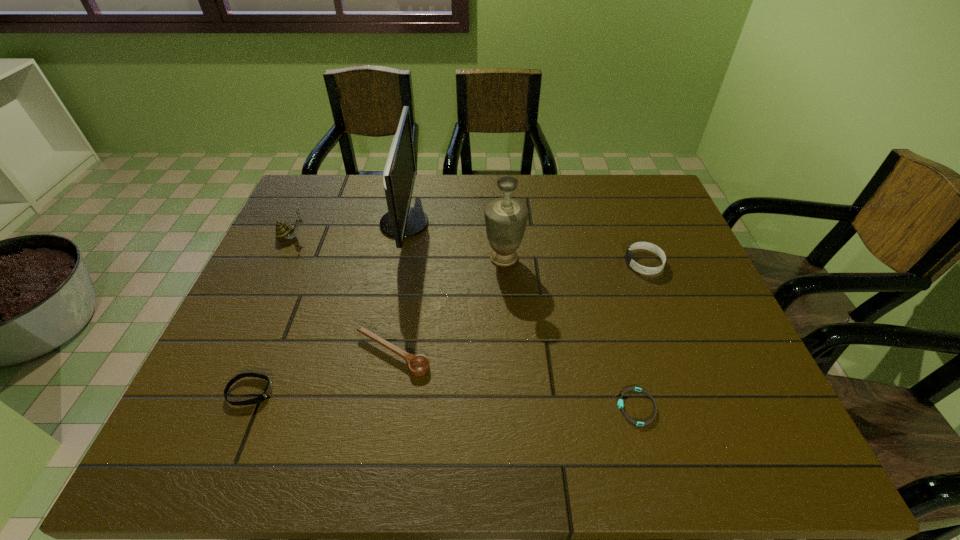
Locate an element on the screen. This screenshot has height=540, width=960. free region located 0.310m on the buckle of the shortest object is located at coordinates (468, 407).

Locate an element on the screen. Image resolution: width=960 pixels, height=540 pixels. vacant space located on the buckle of the shortest object is located at coordinates (492, 407).

Locate an element on the screen. This screenshot has width=960, height=540. free region located 0.150m on the buckle of the shortest object is located at coordinates tap(544, 407).

Find the location of a particular element. object that is at the far edge is located at coordinates (401, 221).

The height and width of the screenshot is (540, 960). Find the location of `object that is at the near edge`. object that is at the near edge is located at coordinates (620, 405).

Image resolution: width=960 pixels, height=540 pixels. What are the coordinates of `snail situated at the left edge` in the screenshot? It's located at [283, 230].

This screenshot has height=540, width=960. Find the location of `wristband that is positioned at the left edge`. wristband that is positioned at the left edge is located at coordinates (268, 389).

Find the location of a particular element. The height and width of the screenshot is (540, 960). object that is positioned at the right edge is located at coordinates (629, 257).

Find the location of a particular element. free space at the far edge of the desktop is located at coordinates (427, 211).

Locate an element on the screen. The width and height of the screenshot is (960, 540). free space at the near edge is located at coordinates pos(701,446).